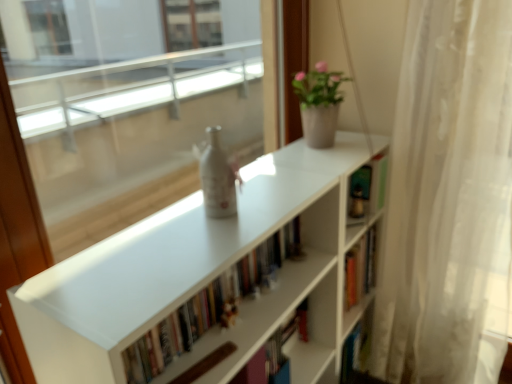
Question: Does white matte bookcase at center appear on the left side of white sheer curtain at right?

Choices:
 (A) no
 (B) yes

Answer: (B)

Question: Is white matte bookcase at center facing away from white sheer curtain at right?

Choices:
 (A) yes
 (B) no

Answer: (B)

Question: From a real-world perspective, is white matte bookcase at center under white sheer curtain at right?

Choices:
 (A) no
 (B) yes

Answer: (B)

Question: Is the surface of white matte bookcase at center in direct contact with white sheer curtain at right?

Choices:
 (A) yes
 (B) no

Answer: (B)

Question: Is white matte bookcase at center smaller than white sheer curtain at right?

Choices:
 (A) yes
 (B) no

Answer: (B)

Question: Considering their positions, is white sheer curtain at right located in front of or behind white matte bookshelf at center?

Choices:
 (A) behind
 (B) front

Answer: (A)

Question: In the image, is white sheer curtain at right on the left side or the right side of white matte bookshelf at center?

Choices:
 (A) right
 (B) left

Answer: (A)

Question: From a real-world perspective, is white sheer curtain at right above or below white matte bookshelf at center?

Choices:
 (A) below
 (B) above

Answer: (A)

Question: Choose the correct answer: Is white sheer curtain at right inside white matte bookshelf at center or outside it?

Choices:
 (A) inside
 (B) outside

Answer: (B)

Question: Is matte white pot at upper right in front of or behind white sheer curtain at right in the image?

Choices:
 (A) front
 (B) behind

Answer: (B)

Question: Considering the positions of matte white pot at upper right and white sheer curtain at right in the image, is matte white pot at upper right wider or thinner than white sheer curtain at right?

Choices:
 (A) thin
 (B) wide

Answer: (A)

Question: From the image's perspective, relative to white sheer curtain at right, is matte white pot at upper right above or below?

Choices:
 (A) below
 (B) above

Answer: (B)

Question: Is point (328, 125) closer or farther from the camera than point (399, 127)?

Choices:
 (A) farther
 (B) closer

Answer: (A)

Question: Considering the positions of white matte bookshelf at center and matte white pot at upper right in the image, is white matte bookshelf at center taller or shorter than matte white pot at upper right?

Choices:
 (A) short
 (B) tall

Answer: (A)

Question: Visually, is white matte bookshelf at center positioned to the left or to the right of matte white pot at upper right?

Choices:
 (A) left
 (B) right

Answer: (A)